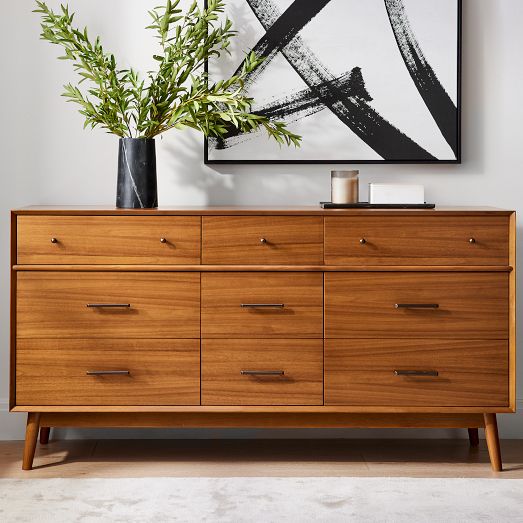
Find the location of a particular element. This screenshot has width=523, height=523. shadow of leaves on wall is located at coordinates (188, 165).